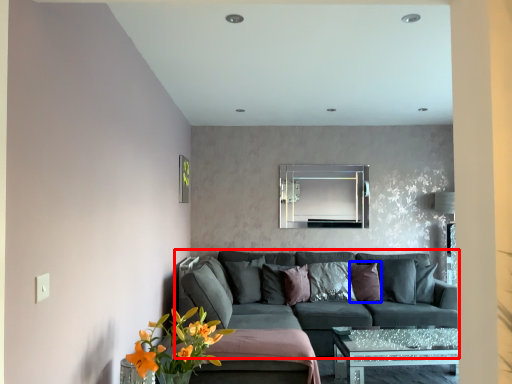
Question: Which object appears farthest to the camera in this image, studio couch (highlighted by a red box) or pillow (highlighted by a blue box)?

Choices:
 (A) studio couch
 (B) pillow

Answer: (B)